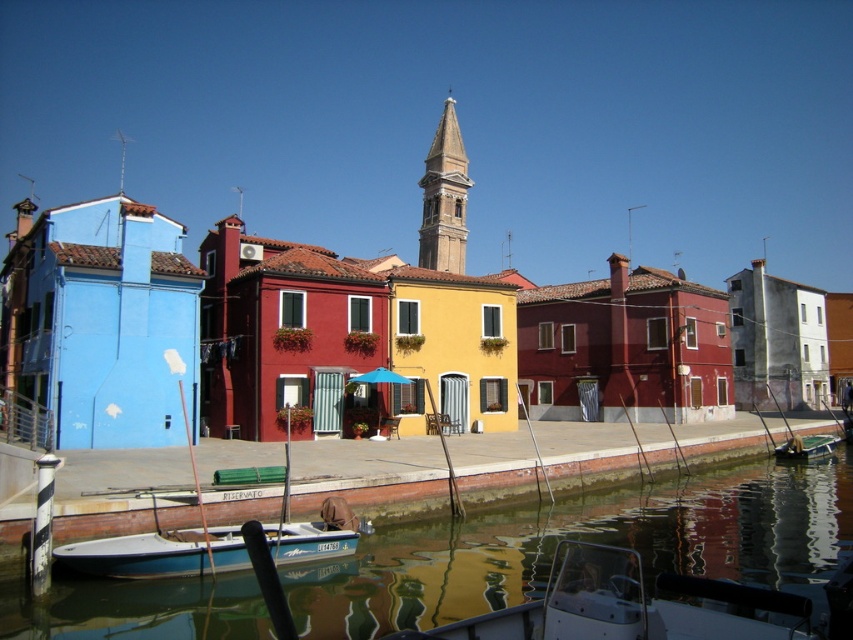
You are standing on the dock and see the greenish reflective water at lower center and the smooth stone bell tower at center. Which object is closer to your right side?

The greenish reflective water at lower center is to the right of smooth stone bell tower at center, so it is closer to your right side.

You are standing at the point marked as point (x=641, y=449) in the canal village scene. What type of surface are you currently standing on?

You are standing on a smooth concrete dock at center located at point (x=641, y=449).